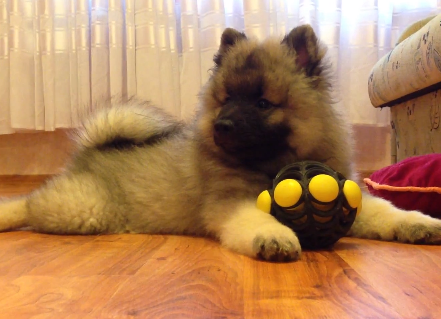
What are the coordinates of `baseboard` in the screenshot? It's located at (22, 182).